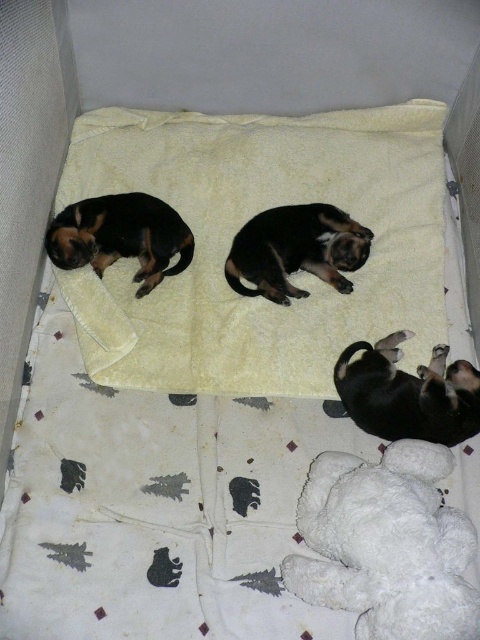
You are a dog trainer observing the puppies in the carrier. There is a white plush teddy bear at lower right. Where is the teddy bear positioned relative to the puppies?

The white plush teddy bear at lower right is located at point 0.852 on the x axis and 0.806 on the y axis, which is towards the lower right corner of the carrier.

Consider the image. You are holding a toy that is 5 feet long and want to place it on the yellow soft blanket at upper center. Can the toy fit on the blanket?

The yellow soft blanket at upper center is 4.92 feet from viewer, so the toy is longer than the distance to the blanket. Therefore, the toy cannot be placed on the blanket without extending beyond the blanket.

You are a dog owner who wants to place a new toy for your dog in the image. The toy needs to be placed between the yellow soft blanket at upper center and the black fur dog at center. Can you place it there?

The yellow soft blanket at upper center is positioned on the left side of black fur dog at center, so yes, you can place the toy between them as there is space between the two objects.